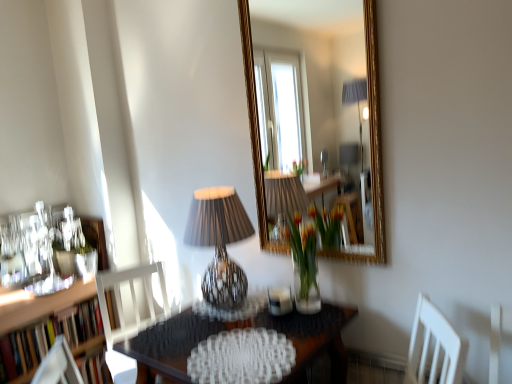
Question: From the image's perspective, is wooden bookshelf at left on matte black lampshade at center?

Choices:
 (A) yes
 (B) no

Answer: (B)

Question: Considering the relative positions of wooden bookshelf at left and matte black lampshade at center in the image provided, is wooden bookshelf at left to the right of matte black lampshade at center from the viewer's perspective?

Choices:
 (A) no
 (B) yes

Answer: (A)

Question: Is wooden bookshelf at left located outside matte black lampshade at center?

Choices:
 (A) yes
 (B) no

Answer: (A)

Question: Is the depth of wooden bookshelf at left less than that of matte black lampshade at center?

Choices:
 (A) no
 (B) yes

Answer: (A)

Question: From the image's perspective, is wooden bookshelf at left beneath matte black lampshade at center?

Choices:
 (A) yes
 (B) no

Answer: (A)

Question: In terms of width, does wooden table at center look wider or thinner when compared to translucent glass vase at center?

Choices:
 (A) thin
 (B) wide

Answer: (B)

Question: Visually, is wooden table at center positioned to the left or to the right of translucent glass vase at center?

Choices:
 (A) left
 (B) right

Answer: (A)

Question: From a real-world perspective, is wooden table at center above or below translucent glass vase at center?

Choices:
 (A) below
 (B) above

Answer: (A)

Question: In the image, is wooden table at center positioned in front of or behind translucent glass vase at center?

Choices:
 (A) behind
 (B) front

Answer: (B)

Question: Looking at the image, does matte black lampshade at center seem bigger or smaller compared to white wood chair at lower left?

Choices:
 (A) small
 (B) big

Answer: (A)

Question: From their relative heights in the image, would you say matte black lampshade at center is taller or shorter than white wood chair at lower left?

Choices:
 (A) tall
 (B) short

Answer: (B)

Question: From the image's perspective, is matte black lampshade at center above or below white wood chair at lower left?

Choices:
 (A) above
 (B) below

Answer: (A)

Question: Is point (228, 299) closer or farther from the camera than point (118, 311)?

Choices:
 (A) closer
 (B) farther

Answer: (A)

Question: From the image's perspective, is wooden table at center above or below wooden bookshelf at left?

Choices:
 (A) above
 (B) below

Answer: (A)

Question: Does point [x=132, y=337] appear closer or farther from the camera than point [x=10, y=336]?

Choices:
 (A) closer
 (B) farther

Answer: (A)